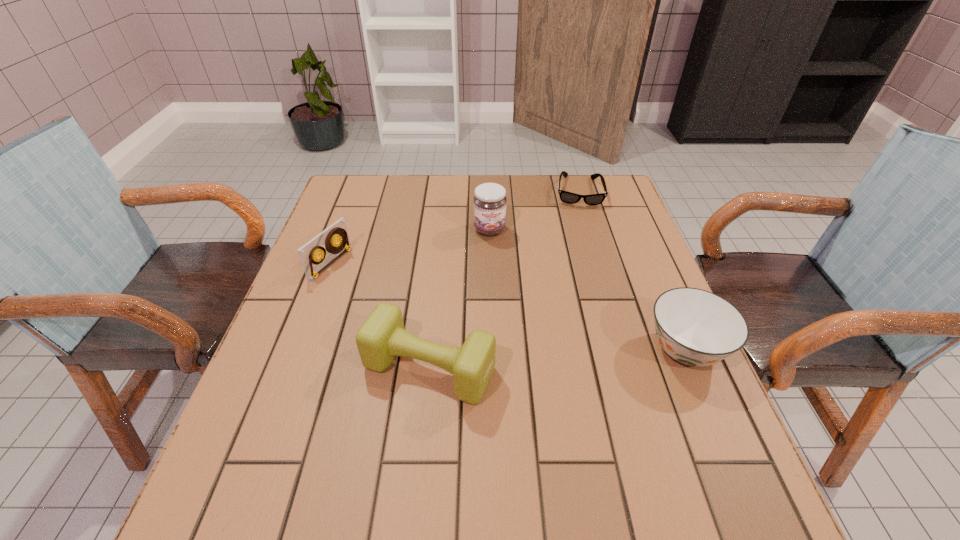
Identify which object is located as the third nearest to the leftmost object. Please provide its 2D coordinates. Your answer should be formatted as a tuple, i.e. [(x, y)], where the tuple contains the x and y coordinates of a point satisfying the conditions above.

[(567, 197)]

Identify which object is the third closest to the leftmost object. Please provide its 2D coordinates. Your answer should be formatted as a tuple, i.e. [(x, y)], where the tuple contains the x and y coordinates of a point satisfying the conditions above.

[(567, 197)]

At what (x,y) coordinates should I click in order to perform the action: click on vacant point that satisfies the following two spatial constraints: 1. on the front side of the videotape; 2. on the left side of the soup bowl. Please return your answer as a coordinate pair (x, y). The height and width of the screenshot is (540, 960). Looking at the image, I should click on (300, 349).